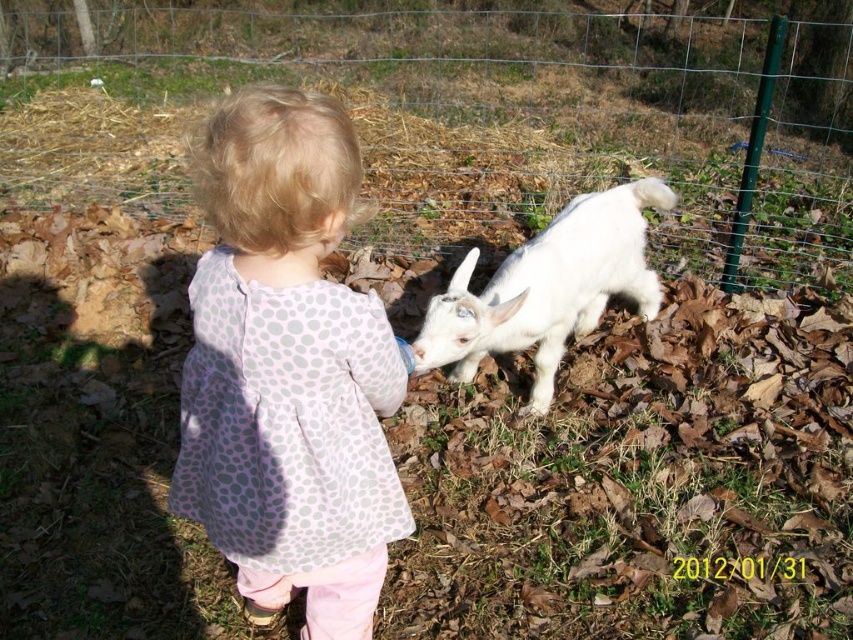
Does pink dotted fabric at center have a smaller size compared to white fluffy goat at center?

Yes, pink dotted fabric at center is smaller than white fluffy goat at center.

What do you see at coordinates (288, 369) in the screenshot? The image size is (853, 640). I see `pink dotted fabric at center` at bounding box center [288, 369].

Is point (389, 488) in front of point (549, 305)?

Yes, it is in front of point (549, 305).

You are a GUI agent. You are given a task and a screenshot of the screen. Output one action in this format:
    pyautogui.click(x=<x>, y=<y>)
    Task: Click on the pink dotted fabric at center
    This screenshot has width=853, height=640.
    Given the screenshot: What is the action you would take?
    pyautogui.click(x=288, y=369)

Is wire mesh fence at center wider than pink dotted fabric at center?

Indeed, wire mesh fence at center has a greater width compared to pink dotted fabric at center.

Can you confirm if wire mesh fence at center is taller than pink dotted fabric at center?

Correct, wire mesh fence at center is much taller as pink dotted fabric at center.

You are a GUI agent. You are given a task and a screenshot of the screen. Output one action in this format:
    pyautogui.click(x=<x>, y=<y>)
    Task: Click on the wire mesh fence at center
    
    Given the screenshot: What is the action you would take?
    pyautogui.click(x=473, y=116)

Identify the location of wire mesh fence at center. This screenshot has height=640, width=853. (473, 116).

Does wire mesh fence at center have a larger size compared to white fluffy goat at center?

Yes, wire mesh fence at center is bigger than white fluffy goat at center.

In order to click on wire mesh fence at center in this screenshot , I will do `click(473, 116)`.